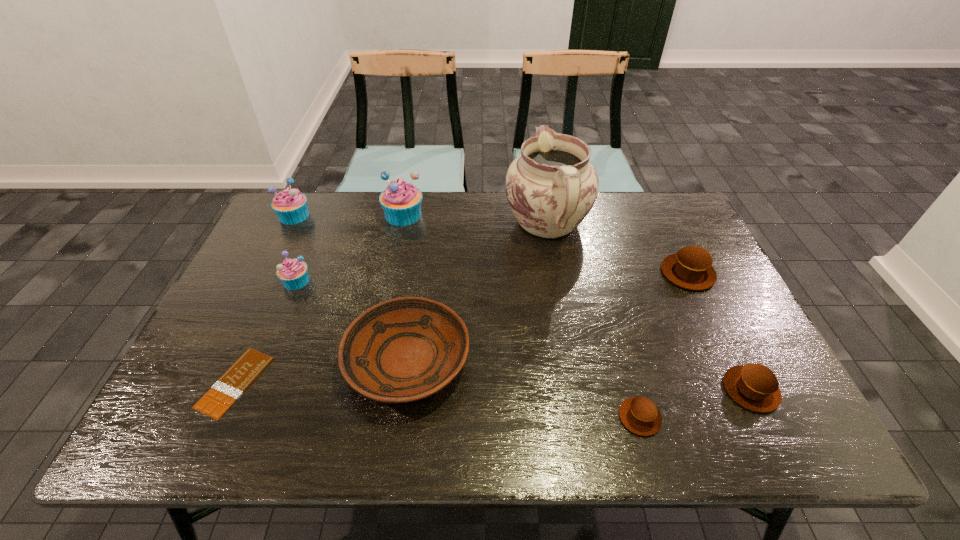
Where is `vacant space that satisfies the following two spatial constraints: 1. on the back side of the second biggest blue muffin; 2. on the left side of the fourth muffin from right to left`? The image size is (960, 540). vacant space that satisfies the following two spatial constraints: 1. on the back side of the second biggest blue muffin; 2. on the left side of the fourth muffin from right to left is located at coordinates (295, 215).

Locate an element on the screen. vacant space that satisfies the following two spatial constraints: 1. on the front side of the fifth shortest muffin; 2. on the left side of the farthest brown muffin is located at coordinates (266, 273).

Locate an element on the screen. blank area in the image that satisfies the following two spatial constraints: 1. on the back side of the second tallest object; 2. on the right side of the smallest blue muffin is located at coordinates (324, 215).

This screenshot has width=960, height=540. In order to click on free region that satisfies the following two spatial constraints: 1. on the back side of the shortest object; 2. on the left side of the farthest brown muffin in this screenshot , I will do `click(284, 273)`.